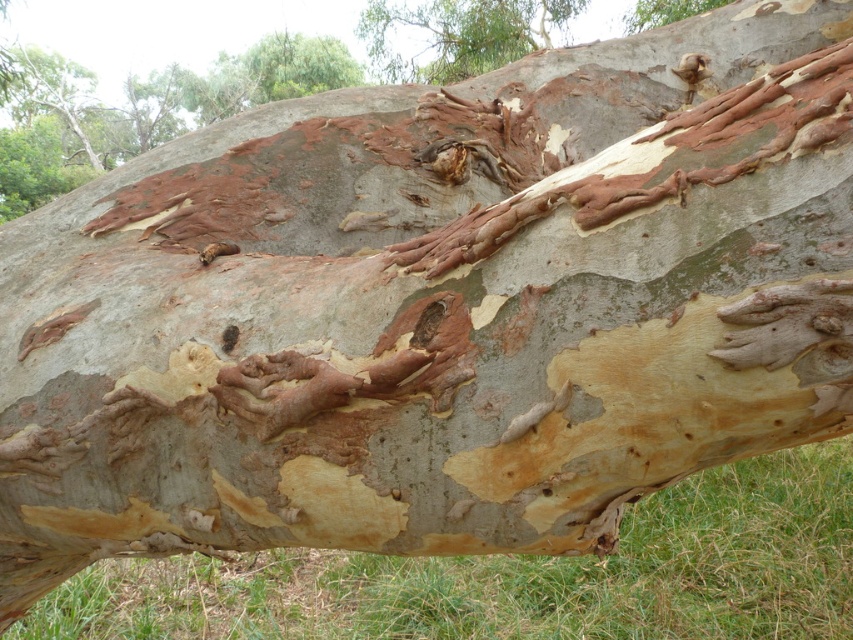
Question: Is smooth bark tree trunk at upper center above smooth brown bark at upper center?

Choices:
 (A) no
 (B) yes

Answer: (B)

Question: Which point appears farthest from the camera in this image?

Choices:
 (A) (503, 1)
 (B) (708, 3)

Answer: (A)

Question: Does smooth bark tree trunk at upper center appear under smooth brown bark at upper center?

Choices:
 (A) no
 (B) yes

Answer: (A)

Question: Can you confirm if smooth bark tree trunk at upper center is positioned below smooth brown bark at upper center?

Choices:
 (A) no
 (B) yes

Answer: (A)

Question: Which object appears farthest from the camera in this image?

Choices:
 (A) smooth bark tree trunk at upper center
 (B) smooth brown bark at upper center

Answer: (A)